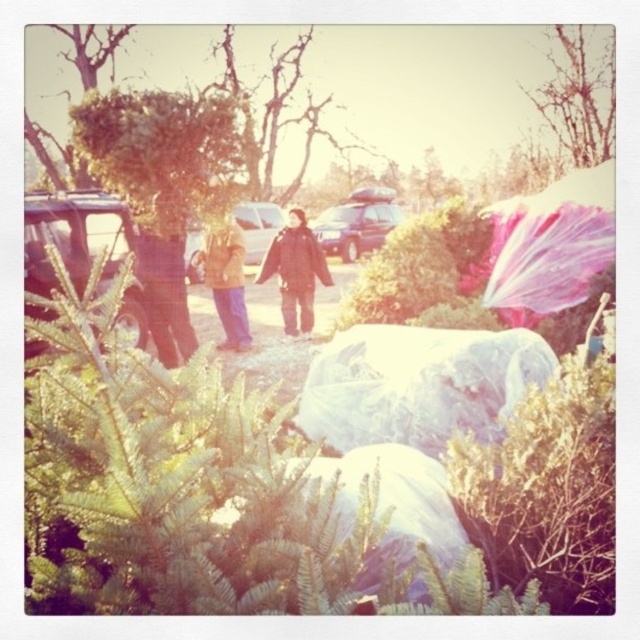
Question: Which object appears farthest from the camera in this image?

Choices:
 (A) transparent plastic bag at center
 (B) bare branches at upper right
 (C) bare branches at center

Answer: (B)

Question: Is metallic silver car at left bigger than black matte jacket at center?

Choices:
 (A) no
 (B) yes

Answer: (B)

Question: Which point appears farthest from the camera in this image?

Choices:
 (A) (317, 112)
 (B) (264, 236)
 (C) (564, 147)
 (D) (323, 268)

Answer: (A)

Question: Can you confirm if transparent plastic bag at center is wider than light brown fabric jacket at center?

Choices:
 (A) no
 (B) yes

Answer: (B)

Question: Is metallic silver car at left below bare branches at center?

Choices:
 (A) no
 (B) yes

Answer: (B)

Question: Estimate the real-world distances between objects in this image. Which object is farther from the matte brown car at center?

Choices:
 (A) black matte jacket at center
 (B) transparent plastic bag at center
 (C) light brown fabric jacket at center

Answer: (B)